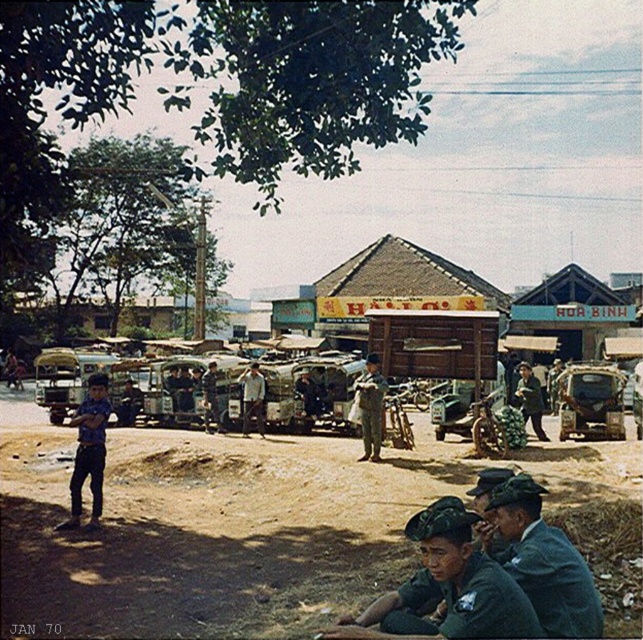
Question: Is camouflage fabric jeep at center bigger than blue denim shirt at left?

Choices:
 (A) yes
 (B) no

Answer: (A)

Question: Estimate the real-world distances between objects in this image. Which object is closer to the green uniform at lower right?

Choices:
 (A) camouflage fabric jeep at center
 (B) brown sandy dirt field at center
 (C) blue denim shirt at left

Answer: (B)

Question: Which point is farther to the camera?

Choices:
 (A) green uniform at lower right
 (B) brown sandy dirt field at center

Answer: (B)

Question: Does blue denim shirt at left have a larger size compared to dark green uniform at center?

Choices:
 (A) no
 (B) yes

Answer: (A)

Question: Among these points, which one is farthest from the camera?

Choices:
 (A) (249, 413)
 (B) (529, 404)
 (C) (300, 616)

Answer: (A)

Question: Is camouflage fabric jeep at center further to camera compared to dark green uniform at center?

Choices:
 (A) no
 (B) yes

Answer: (B)